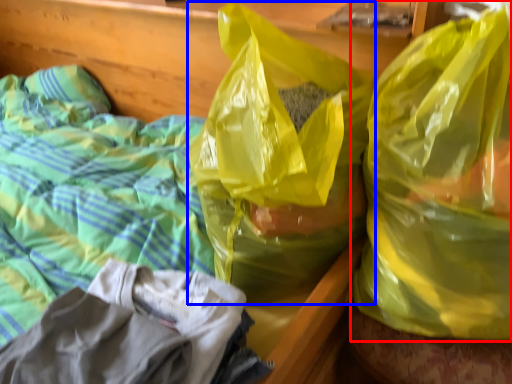
Question: Which point is closer to the camera, plastic bag (highlighted by a red box) or plastic bag (highlighted by a blue box)?

Choices:
 (A) plastic bag
 (B) plastic bag

Answer: (A)